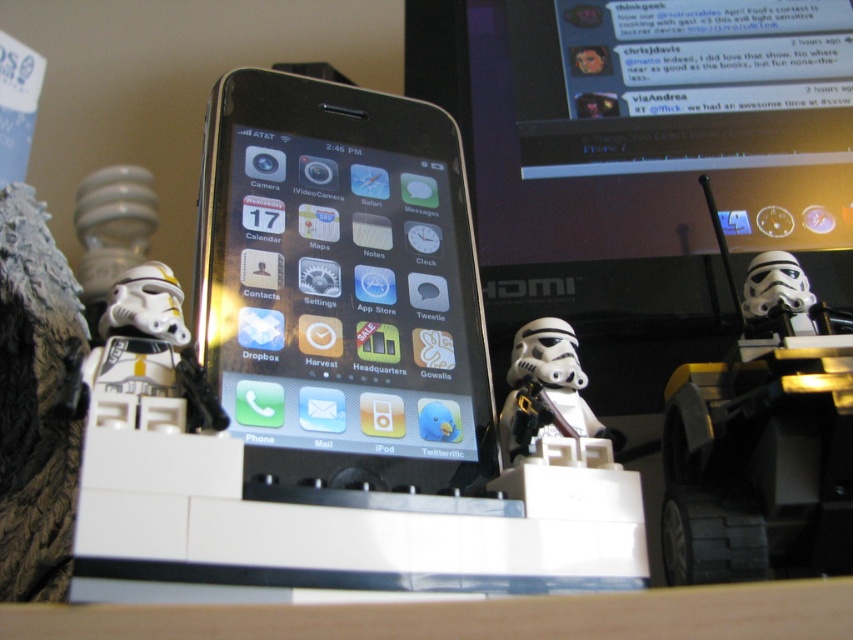
Question: Which point is closer to the camera taking this photo?

Choices:
 (A) (747, 449)
 (B) (151, 380)

Answer: (B)

Question: Does white plastic stormtrooper helmet at right have a lesser width compared to white plastic stormtrooper at left?

Choices:
 (A) yes
 (B) no

Answer: (B)

Question: Which of these objects is positioned farthest from the white matte stormtrooper helmet at center?

Choices:
 (A) white plastic stormtrooper at left
 (B) black glossy smartphone at center

Answer: (A)

Question: Is black glossy smartphone at center to the right of white matte stormtrooper helmet at center from the viewer's perspective?

Choices:
 (A) yes
 (B) no

Answer: (B)

Question: Does white plastic stormtrooper helmet at right have a greater width compared to white plastic stormtrooper at left?

Choices:
 (A) yes
 (B) no

Answer: (A)

Question: Based on their relative distances, which object is farther from the white plastic stormtrooper helmet at right?

Choices:
 (A) black glossy smartphone at center
 (B) white matte stormtrooper helmet at center

Answer: (A)